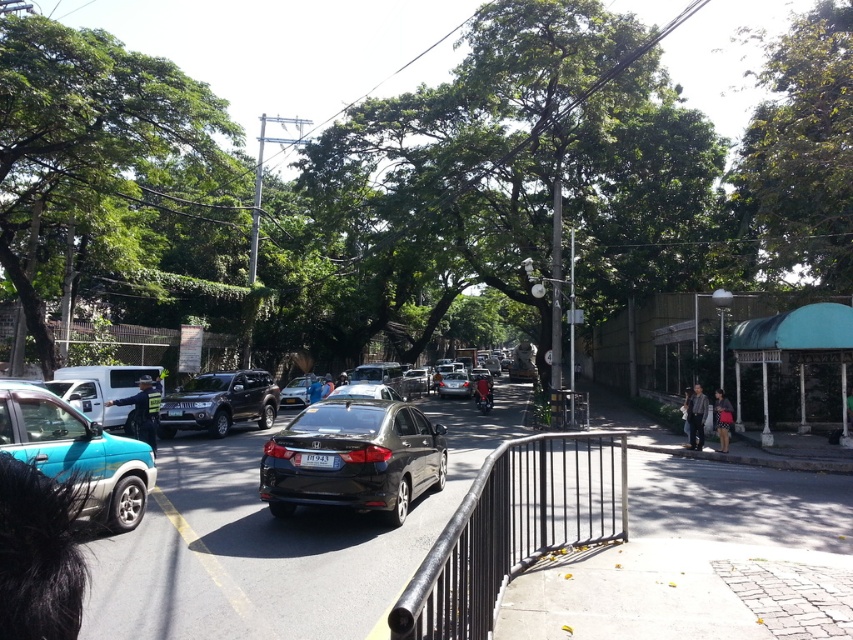
Question: Does green leafy tree at upper right have a greater width compared to blue fabric jacket at center?

Choices:
 (A) no
 (B) yes

Answer: (B)

Question: Which object appears closest to the camera in this image?

Choices:
 (A) blue fabric jacket at center
 (B) green leafy tree at upper right

Answer: (B)

Question: Which point is farther to the camera?

Choices:
 (A) (717, 428)
 (B) (468, 384)

Answer: (B)

Question: Is satin silver sedan at center above matte black car at center?

Choices:
 (A) yes
 (B) no

Answer: (B)

Question: Which object is the farthest from the dark blue uniform at center?

Choices:
 (A) green leafy tree at upper right
 (B) teal matte suv at lower left
 (C) matte black sedan at center
 (D) green leafy tree at center

Answer: (D)

Question: Is teal matte suv at lower left smaller than dark blue uniform at center?

Choices:
 (A) no
 (B) yes

Answer: (A)